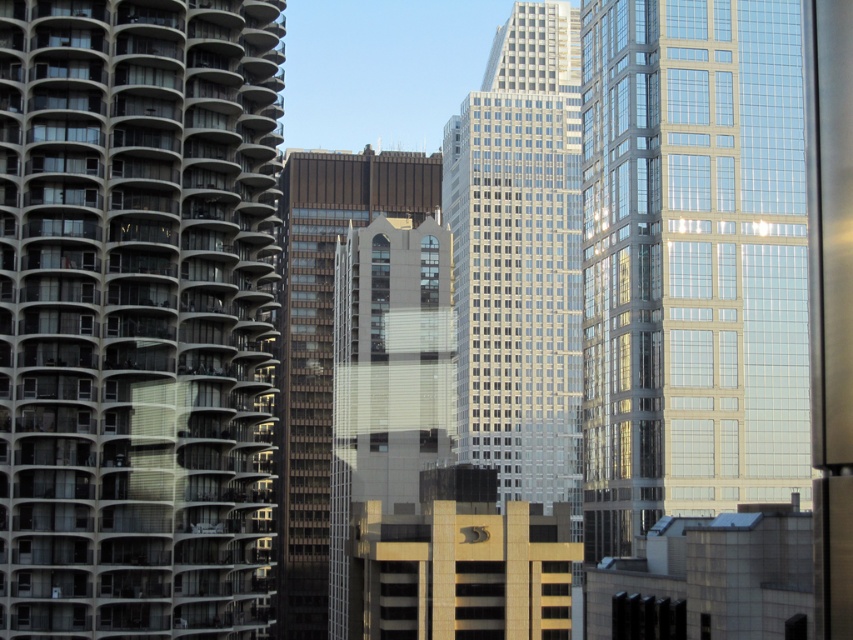
This screenshot has height=640, width=853. What do you see at coordinates (137, 316) in the screenshot?
I see `white concrete building at left` at bounding box center [137, 316].

Is point (117, 618) positioned in front of point (293, 444)?

Yes, it is in front of point (293, 444).

At what (x,y) coordinates should I click in order to perform the action: click on white concrete building at left. Please return your answer as a coordinate pair (x, y). The image size is (853, 640). Looking at the image, I should click on (137, 316).

Which is in front, point (770, 198) or point (281, 259)?

Point (770, 198) is more forward.

Can you confirm if clear glass skyscraper at right is thinner than brown glassy building at center?

Correct, clear glass skyscraper at right's width is less than brown glassy building at center's.

Image resolution: width=853 pixels, height=640 pixels. What are the coordinates of `clear glass skyscraper at right` in the screenshot? It's located at (691, 260).

Is glassy silver skyscraper at center further to the viewer compared to brown glassy building at center?

That is False.

Is glassy silver skyscraper at center below brown glassy building at center?

Actually, glassy silver skyscraper at center is above brown glassy building at center.

Where is `glassy silver skyscraper at center`? This screenshot has height=640, width=853. glassy silver skyscraper at center is located at coordinates (520, 257).